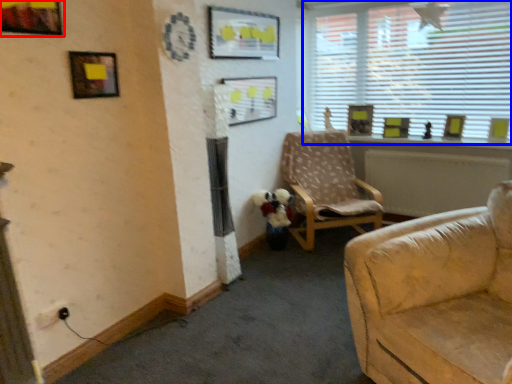
Question: Among these objects, which one is nearest to the camera, picture frame (highlighted by a red box) or window (highlighted by a blue box)?

Choices:
 (A) picture frame
 (B) window

Answer: (A)